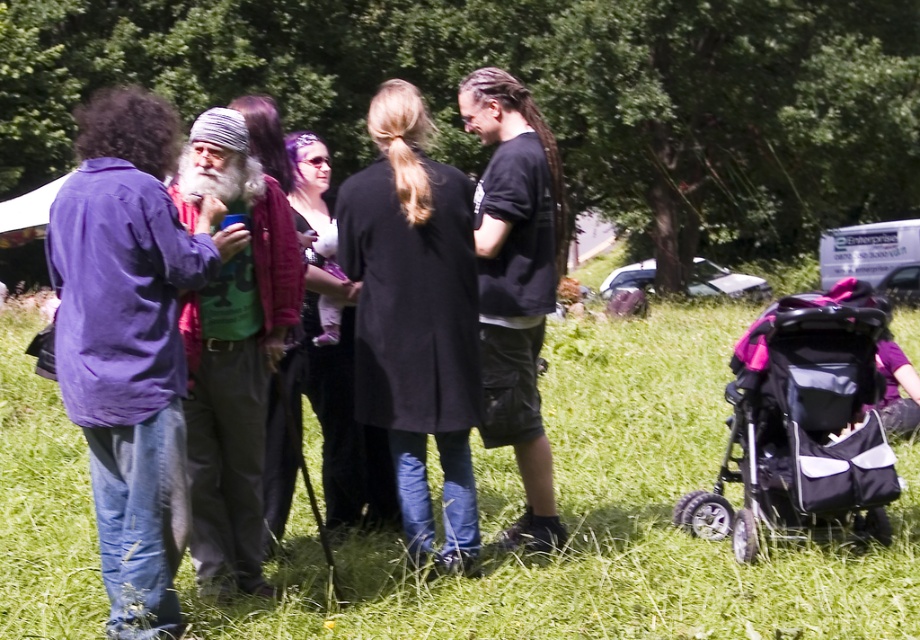
Question: Estimate the real-world distances between objects in this image. Which object is farther from the purple cotton shirt at left?

Choices:
 (A) black cotton t-shirt at center
 (B) green grass at center

Answer: (B)

Question: Which point is closer to the camera?

Choices:
 (A) (132, 474)
 (B) (853, 454)
 (C) (439, 486)

Answer: (A)

Question: Does matte purple jacket at center appear on the right side of purple cotton shirt at left?

Choices:
 (A) no
 (B) yes

Answer: (B)

Question: Which object appears farthest from the camera in this image?

Choices:
 (A) green grass at center
 (B) pink fabric stroller at lower right
 (C) green cotton shirt at center

Answer: (B)

Question: Is matte purple jacket at center positioned in front of black cotton t-shirt at center?

Choices:
 (A) yes
 (B) no

Answer: (A)

Question: Is purple cotton shirt at left closer to camera compared to black cotton t-shirt at center?

Choices:
 (A) yes
 (B) no

Answer: (A)